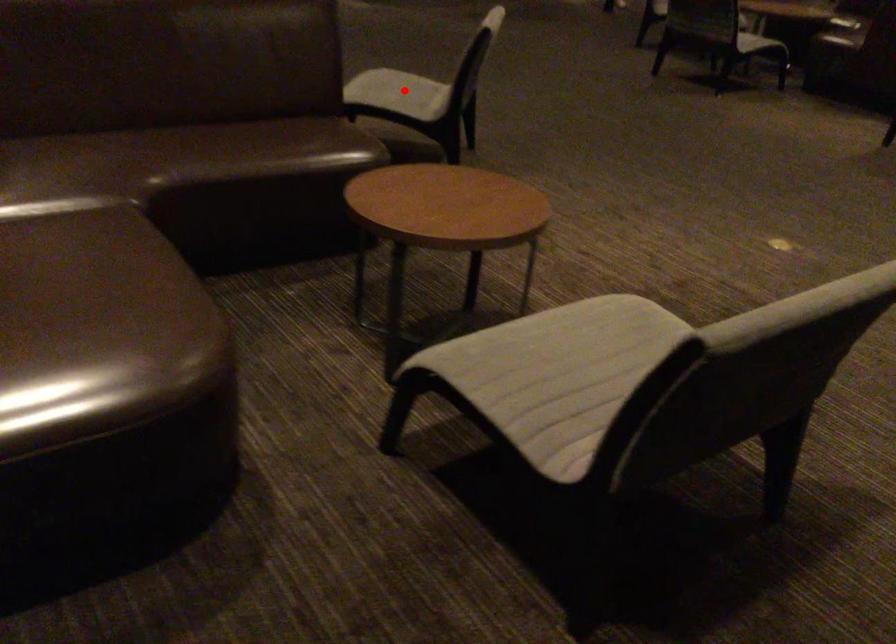
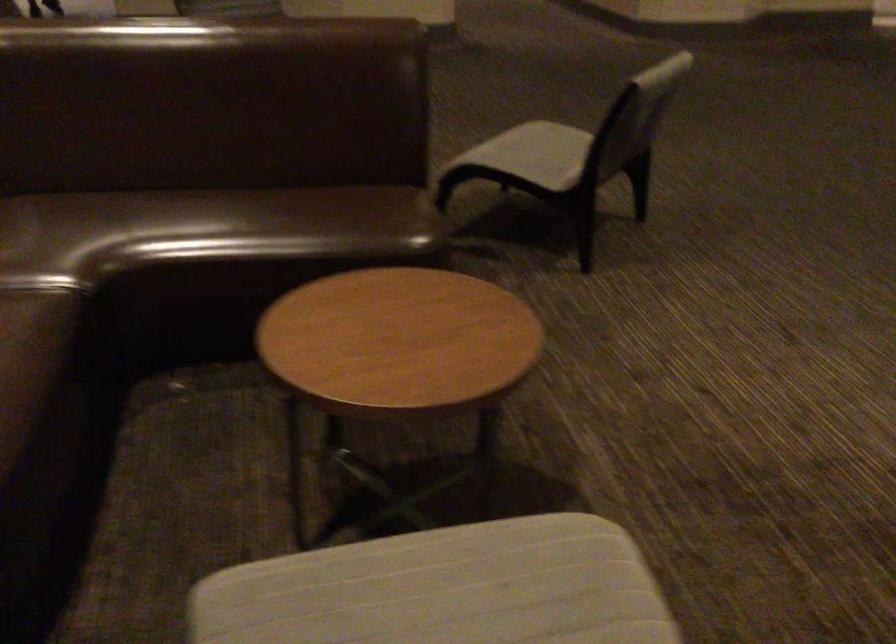
Question: I am providing you with two images of the same scene from different viewpoints. A red point is shown in image1. For the corresponding object point in image2, is it positioned nearer or farther from the camera?

Choices:
 (A) Nearer
 (B) Farther

Answer: (A)